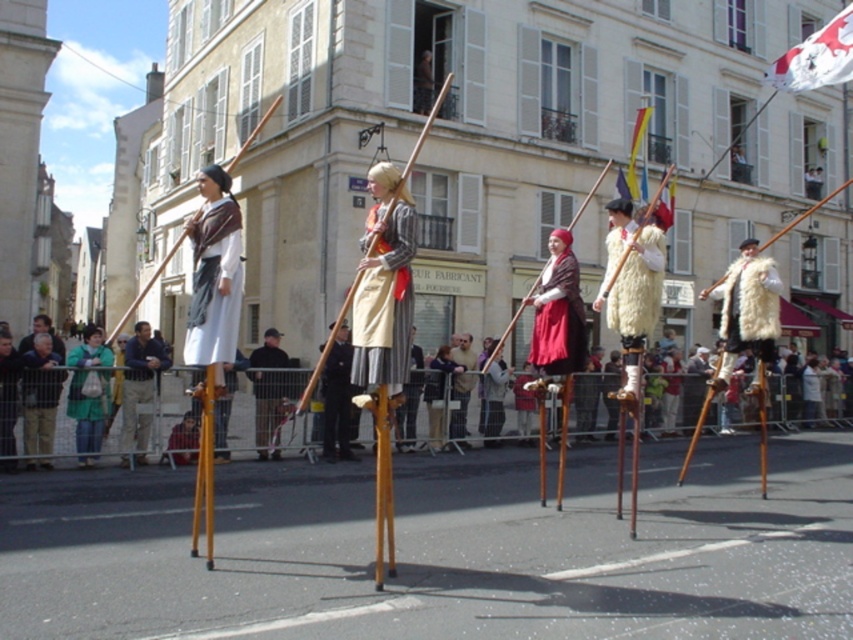
Question: Is dark brown leather boots at center closer to camera compared to matte brown wooden staff at center?

Choices:
 (A) yes
 (B) no

Answer: (A)

Question: Among these points, which one is farthest from the camera?

Choices:
 (A) (390, 224)
 (B) (544, 282)
 (C) (76, 380)
 (D) (605, 301)

Answer: (C)

Question: Can you confirm if fuzzy white coat at center is bigger than multicolored fabric flag at center?

Choices:
 (A) yes
 (B) no

Answer: (A)

Question: Which object is farther from the camera taking this photo?

Choices:
 (A) white fabric flag at upper right
 (B) red woolen cape at center

Answer: (A)

Question: Observing the image, what is the correct spatial positioning of fuzzy white coat at center in reference to multicolored fabric flag at center?

Choices:
 (A) left
 (B) right

Answer: (A)

Question: Which object is closer to the camera taking this photo?

Choices:
 (A) dark brown leather jacket at center
 (B) khaki pants at center
 (C) multicolored fabric flag at center
 (D) fuzzy white coat at center

Answer: (D)